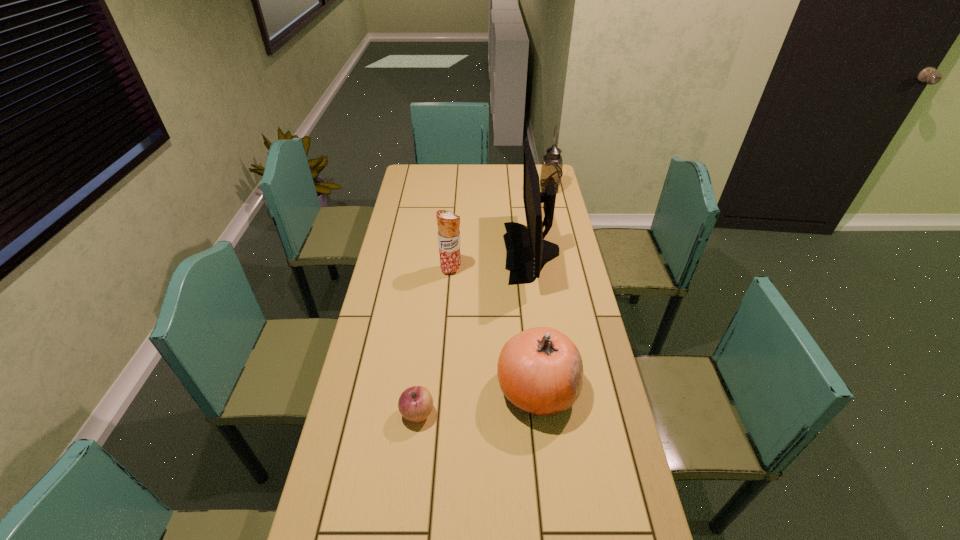
The width and height of the screenshot is (960, 540). What are the coordinates of `vacant space located 0.220m on the back of the pumpkin` in the screenshot? It's located at (528, 305).

I want to click on free region located 0.220m on the right of the shortest object, so click(513, 414).

I want to click on object situated at the far edge, so click(551, 170).

At what (x,y) coordinates should I click in order to perform the action: click on object present at the left edge. Please return your answer as a coordinate pair (x, y). The width and height of the screenshot is (960, 540). Looking at the image, I should click on (415, 403).

You are a GUI agent. You are given a task and a screenshot of the screen. Output one action in this format:
    pyautogui.click(x=<x>, y=<y>)
    Task: Click on the monitor located in the right edge section of the desktop
    
    Given the screenshot: What is the action you would take?
    pyautogui.click(x=527, y=252)

In order to click on oil lamp that is at the right edge in this screenshot , I will do `click(551, 170)`.

Locate an element on the screen. The width and height of the screenshot is (960, 540). pumpkin that is at the right edge is located at coordinates (540, 370).

You are a GUI agent. You are given a task and a screenshot of the screen. Output one action in this format:
    pyautogui.click(x=<x>, y=<y>)
    Task: Click on the object positioned at the far right corner
    
    Given the screenshot: What is the action you would take?
    pyautogui.click(x=551, y=170)

The width and height of the screenshot is (960, 540). In the image, there is a desktop. Identify the location of free space at the far edge. (517, 188).

Find the location of a particular element. This screenshot has height=540, width=960. free region at the left edge is located at coordinates (334, 499).